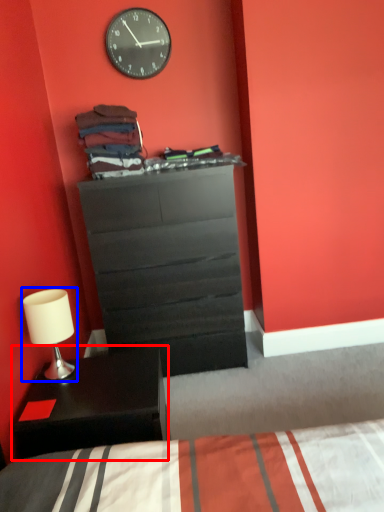
Question: Which object appears farthest to the camera in this image, nightstand (highlighted by a red box) or table lamp (highlighted by a blue box)?

Choices:
 (A) nightstand
 (B) table lamp

Answer: (B)